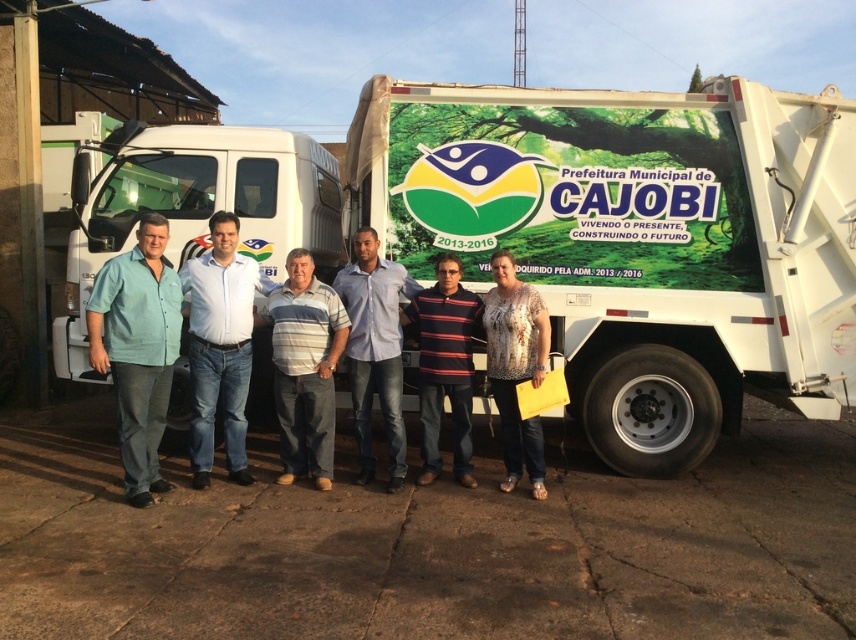
Is point (768, 358) positioned before point (361, 445)?

No, it is not.

How distant is white glossy garbage truck at center from light blue shirt at center?

1.65 meters

Where is `white glossy garbage truck at center`? The image size is (856, 640). white glossy garbage truck at center is located at coordinates (637, 241).

Is white glossy garbage truck at left shorter than printed floral blouse at center?

Incorrect, white glossy garbage truck at left's height does not fall short of printed floral blouse at center's.

Which of these two, white glossy garbage truck at left or printed floral blouse at center, stands taller?

With more height is white glossy garbage truck at left.

Find the location of a particular element. Image resolution: width=856 pixels, height=640 pixels. white glossy garbage truck at left is located at coordinates (195, 205).

Who is higher up, white glossy garbage truck at center or striped knit sweater at center?

white glossy garbage truck at center is above.

Is point (710, 147) behind point (461, 346)?

Yes, it is behind point (461, 346).

Does point (581, 173) come in front of point (429, 426)?

No, it is behind (429, 426).

Where is `white glossy garbage truck at center`? The height and width of the screenshot is (640, 856). white glossy garbage truck at center is located at coordinates (x=637, y=241).